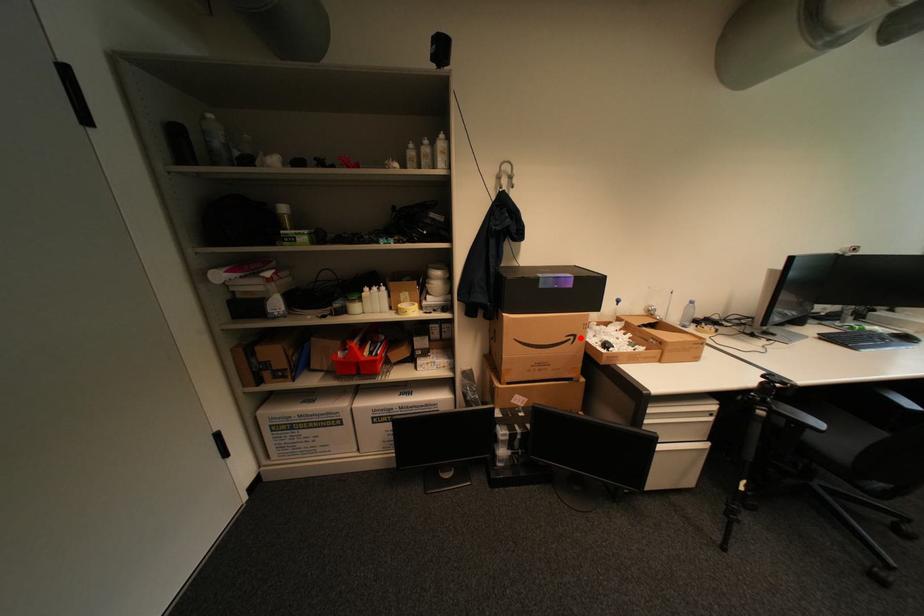
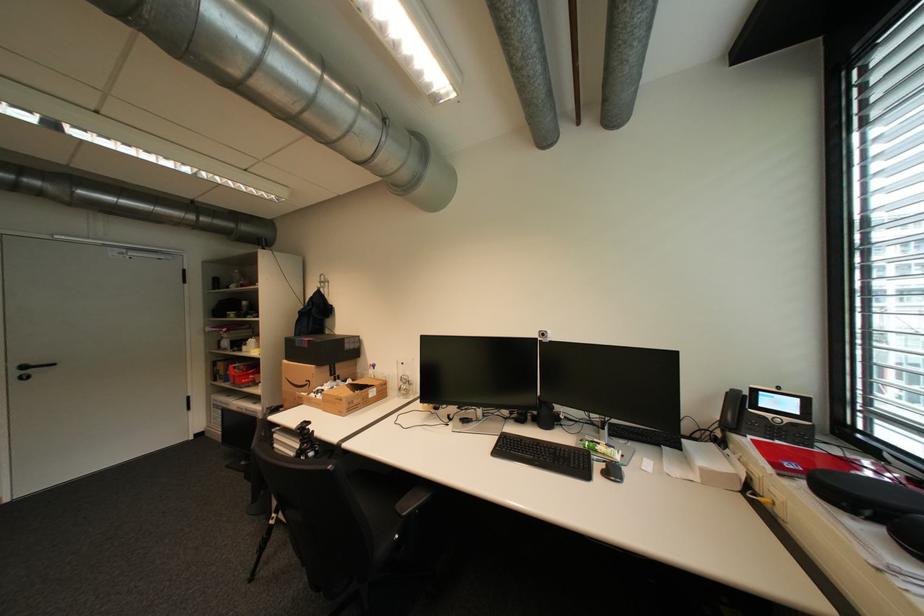
In the second image, find the point that corresponds to the highlighted location in the first image.

(317, 383)